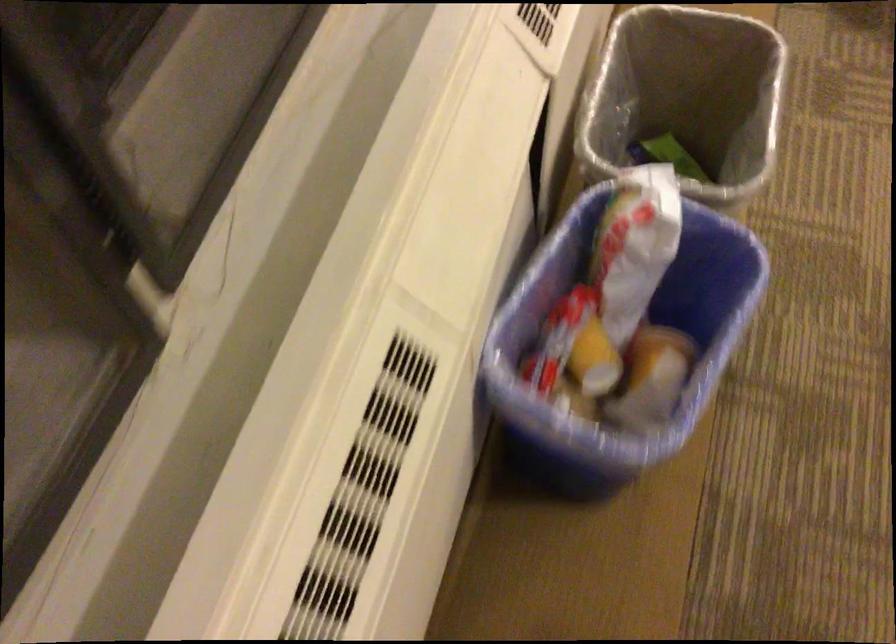
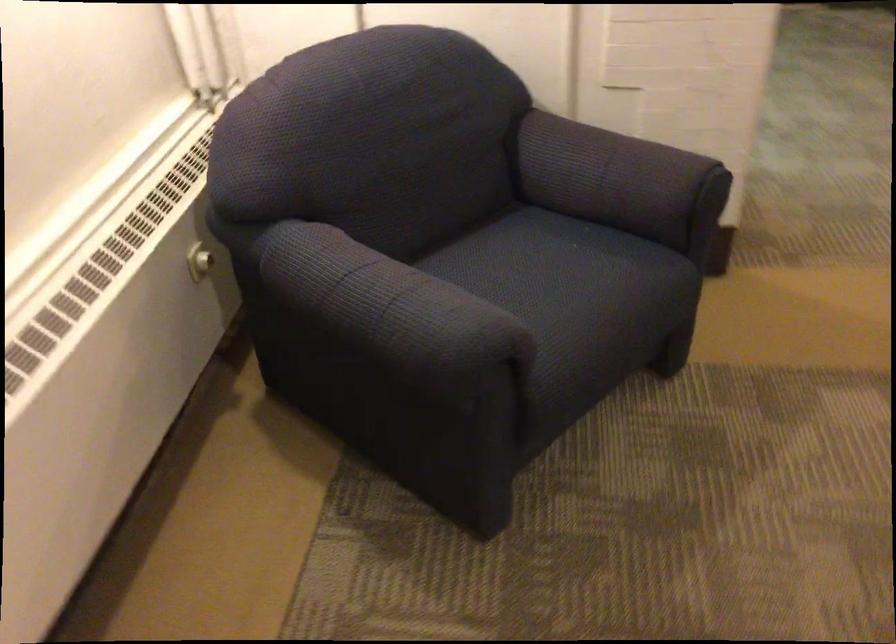
Question: The images are taken continuously from a first-person perspective. In which direction are you moving?

Choices:
 (A) Left
 (B) Right
 (C) Forward
 (D) Backward

Answer: (B)